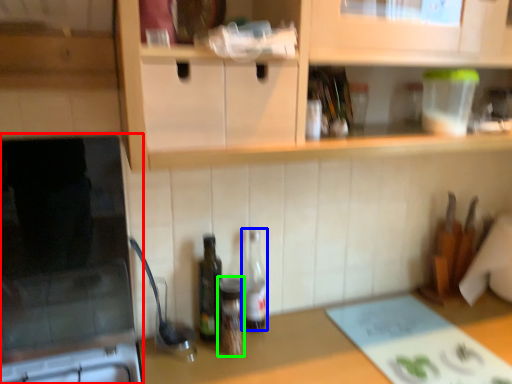
Question: Estimate the real-world distances between objects in this image. Which object is farther from appliance (highlighted by a red box), bottle (highlighted by a blue box) or bottle (highlighted by a green box)?

Choices:
 (A) bottle
 (B) bottle

Answer: (A)